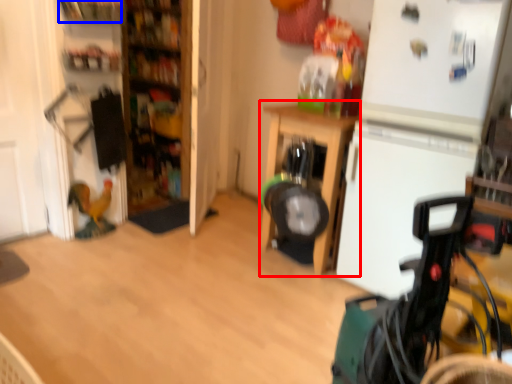
Question: Which of the following is the farthest to the observer, furniture (highlighted by a red box) or shelf (highlighted by a blue box)?

Choices:
 (A) furniture
 (B) shelf

Answer: (B)